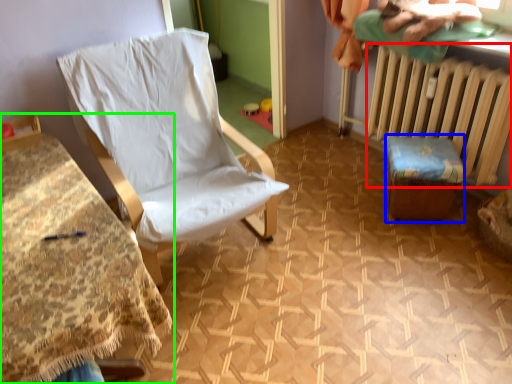
Question: Which is nearer to the radiator (highlighted by a red box)? furniture (highlighted by a blue box) or furniture (highlighted by a green box).

Choices:
 (A) furniture
 (B) furniture

Answer: (A)